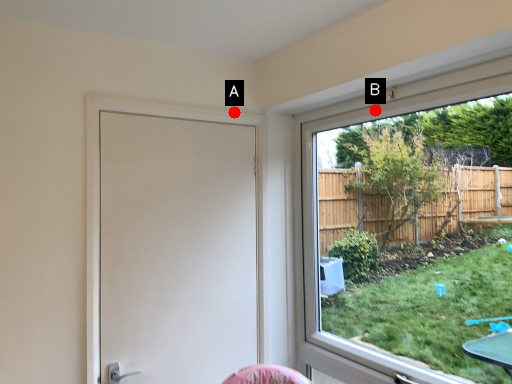
Question: Two points are circled on the image, labeled by A and B beside each circle. Which point is further to the camera?

Choices:
 (A) A is further
 (B) B is further

Answer: (A)